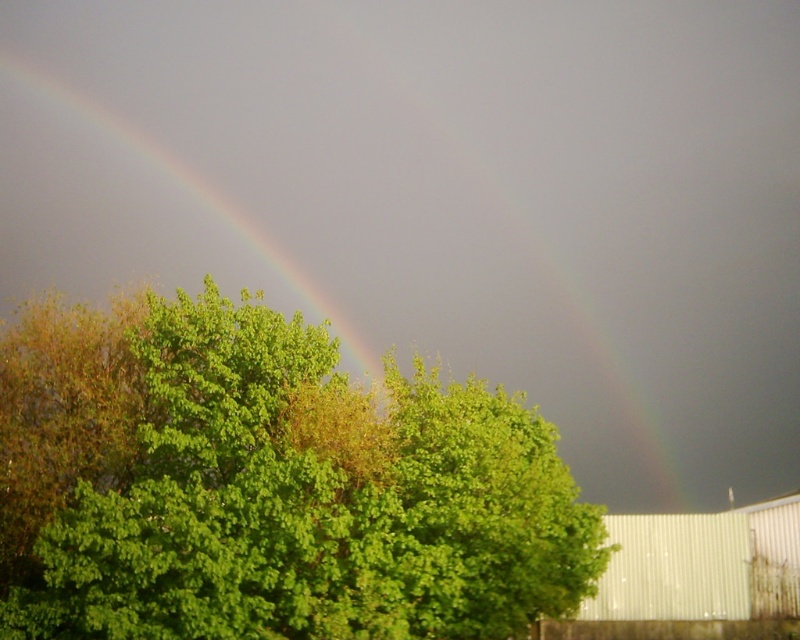
Question: Among these points, which one is nearest to the camera?

Choices:
 (A) (96, 195)
 (B) (542, 454)

Answer: (B)

Question: Is green leafy tree at center above rainbow at upper left?

Choices:
 (A) yes
 (B) no

Answer: (B)

Question: Can you confirm if green leafy tree at center is positioned to the left of rainbow at upper left?

Choices:
 (A) yes
 (B) no

Answer: (B)

Question: Is green leafy tree at center further to the viewer compared to rainbow at upper left?

Choices:
 (A) no
 (B) yes

Answer: (A)

Question: Which object is closer to the camera taking this photo?

Choices:
 (A) green leafy tree at center
 (B) rainbow at upper left

Answer: (A)